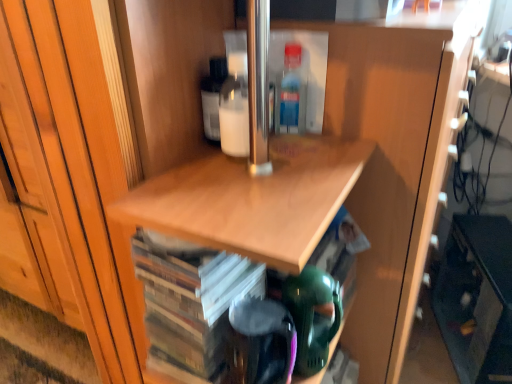
The height and width of the screenshot is (384, 512). In order to click on matte black cabinet at lower right in this screenshot , I will do `click(477, 298)`.

Describe the element at coordinates (291, 92) in the screenshot. I see `translucent plastic bottle at upper center` at that location.

I want to click on wooden cd case at center, so click(x=190, y=303).

Does translucent plastic bottle at upper center have a smaller size compared to matte black cabinet at lower right?

Yes, translucent plastic bottle at upper center is smaller than matte black cabinet at lower right.

Considering the relative positions of translucent plastic bottle at upper center and matte black cabinet at lower right in the image provided, is translucent plastic bottle at upper center in front of matte black cabinet at lower right?

Yes, the depth of translucent plastic bottle at upper center is less than that of matte black cabinet at lower right.

From a real-world perspective, is translucent plastic bottle at upper center located higher than matte black cabinet at lower right?

Indeed, from a real-world perspective, translucent plastic bottle at upper center stands above matte black cabinet at lower right.

Can you confirm if translucent plastic bottle at upper center is thinner than matte black cabinet at lower right?

Correct, the width of translucent plastic bottle at upper center is less than that of matte black cabinet at lower right.

Based on the photo, in terms of width, does matte black cabinet at lower right look wider or thinner when compared to translucent plastic bottle at upper center?

Considering their sizes, matte black cabinet at lower right looks broader than translucent plastic bottle at upper center.

Between matte black cabinet at lower right and translucent plastic bottle at upper center, which one appears on the left side from the viewer's perspective?

translucent plastic bottle at upper center.

Who is shorter, matte black cabinet at lower right or translucent plastic bottle at upper center?

translucent plastic bottle at upper center.

Considering the relative sizes of wooden cd case at center and translucent plastic bottle at upper center in the image provided, is wooden cd case at center smaller than translucent plastic bottle at upper center?

No, wooden cd case at center is not smaller than translucent plastic bottle at upper center.

From the image's perspective, between wooden cd case at center and translucent plastic bottle at upper center, who is located below?

From the image's view, wooden cd case at center is below.

From a real-world perspective, is wooden cd case at center on translucent plastic bottle at upper center?

Actually, wooden cd case at center is physically below translucent plastic bottle at upper center in the real world.

Does wooden cd case at center have a greater height compared to matte black cabinet at lower right?

No.

Can we say wooden cd case at center lies outside matte black cabinet at lower right?

That's correct, wooden cd case at center is outside of matte black cabinet at lower right.

From the image's perspective, is wooden cd case at center located above or below matte black cabinet at lower right?

wooden cd case at center is above matte black cabinet at lower right.

Consider the image. Between wooden cd case at center and matte black cabinet at lower right, which one is positioned in front?

wooden cd case at center is closer to the camera.

Looking at this image, is translucent plastic bottle at upper center to the left of wooden cd case at center from the viewer's perspective?

In fact, translucent plastic bottle at upper center is to the right of wooden cd case at center.

From a real-world perspective, who is located lower, translucent plastic bottle at upper center or wooden cd case at center?

From a 3D spatial view, wooden cd case at center is below.

Considering the points (296, 46) and (234, 277), which point is in front, point (296, 46) or point (234, 277)?

The point (234, 277) is closer.

Can you confirm if translucent plastic bottle at upper center is taller than wooden cd case at center?

In fact, translucent plastic bottle at upper center may be shorter than wooden cd case at center.

In the scene shown: How many degrees apart are the facing directions of matte black cabinet at lower right and wooden cd case at center?

The angular difference between matte black cabinet at lower right and wooden cd case at center is 62.9 degrees.

Is there a large distance between matte black cabinet at lower right and wooden cd case at center?

No, there isn't a large distance between matte black cabinet at lower right and wooden cd case at center.

Locate an element on the screen. This screenshot has height=384, width=512. cabinetry located below the wooden cd case at center (from the image's perspective) is located at coordinates (477, 298).

From a real-world perspective, is matte black cabinet at lower right physically located above or below wooden cd case at center?

matte black cabinet at lower right is situated lower than wooden cd case at center in the real world.

I want to click on cabinetry lying behind the translucent plastic bottle at upper center, so click(477, 298).

The width and height of the screenshot is (512, 384). What are the coordinates of `bottle located in front of the matte black cabinet at lower right` in the screenshot? It's located at (291, 92).

When comparing their distances from translucent plastic bottle at upper center, does matte black cabinet at lower right or wooden cd case at center seem closer?

Based on the image, wooden cd case at center appears to be nearer to translucent plastic bottle at upper center.

Based on the photo, when comparing their distances from matte black cabinet at lower right, does translucent plastic bottle at upper center or wooden cd case at center seem further?

Among the two, translucent plastic bottle at upper center is located further to matte black cabinet at lower right.

From the image, which object appears to be nearer to translucent plastic bottle at upper center, wooden cd case at center or matte black cabinet at lower right?

The object closer to translucent plastic bottle at upper center is wooden cd case at center.

Which object lies further to the anchor point wooden cd case at center, matte black cabinet at lower right or translucent plastic bottle at upper center?

matte black cabinet at lower right is further to wooden cd case at center.

When comparing their distances from wooden cd case at center, does translucent plastic bottle at upper center or matte black cabinet at lower right seem closer?

Among the two, translucent plastic bottle at upper center is located nearer to wooden cd case at center.

From the image, which object appears to be nearer to matte black cabinet at lower right, wooden cd case at center or translucent plastic bottle at upper center?

Among the two, wooden cd case at center is located nearer to matte black cabinet at lower right.

Locate an element on the screen. bottle between wooden cd case at center and matte black cabinet at lower right from left to right is located at coordinates (291, 92).